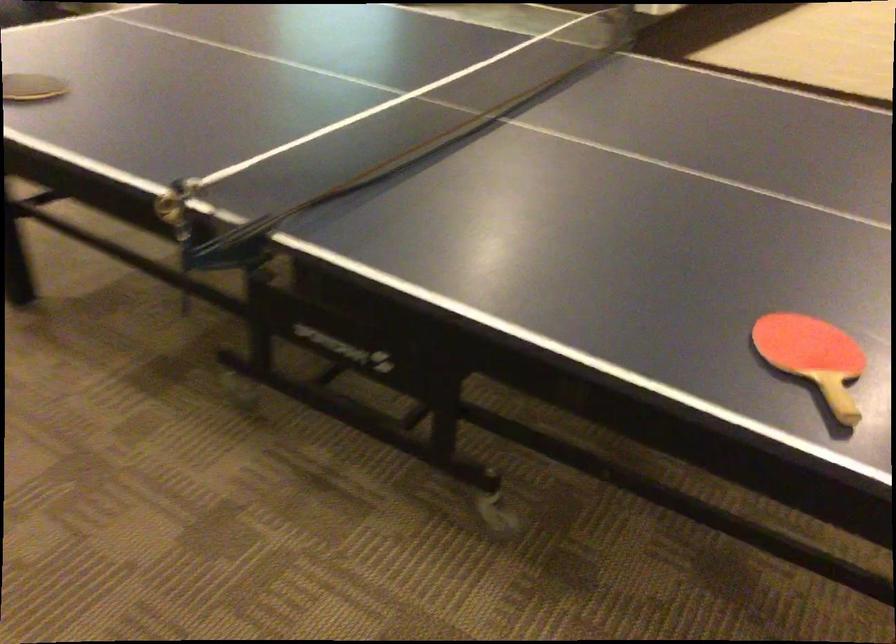
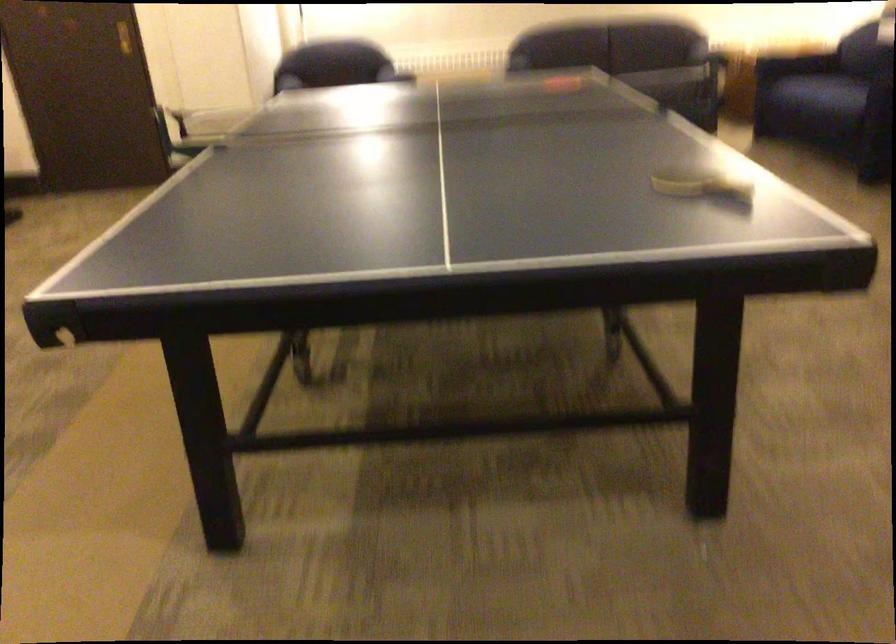
Locate, in the second image, the point that corresponds to the point at 222,249 in the first image.

(668, 82)